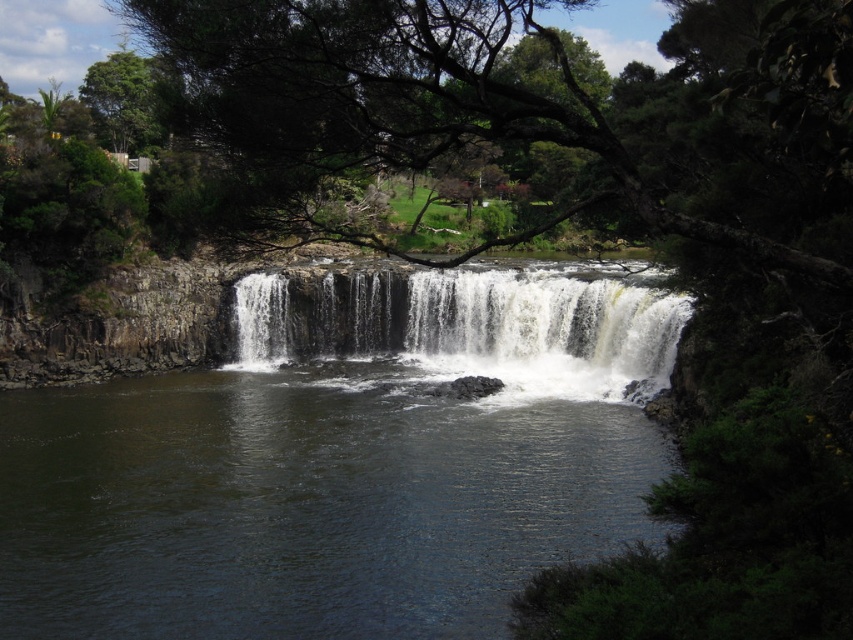
You are standing at the edge of the waterfall and see the dark green water at center and the white textured water at center. Which part of the water is wider?

The dark green water at center is wider than the white textured water at center.

You are standing at the edge of the waterfall and see both the dark green water at center and the white textured water at center. Which one is nearer to you?

The dark green water at center is closer to the viewer than the white textured water at center.

You are a hiker who wants to cross the waterfall area. You see the dark green water at center and the white textured water at center. Which part of the water should you avoid stepping on if you want to cross safely?

You should avoid stepping on the white textured water at center because it is part of the cascading waterfall with flowing water, while the dark green water at center is calmer and deeper, making it safer to cross.